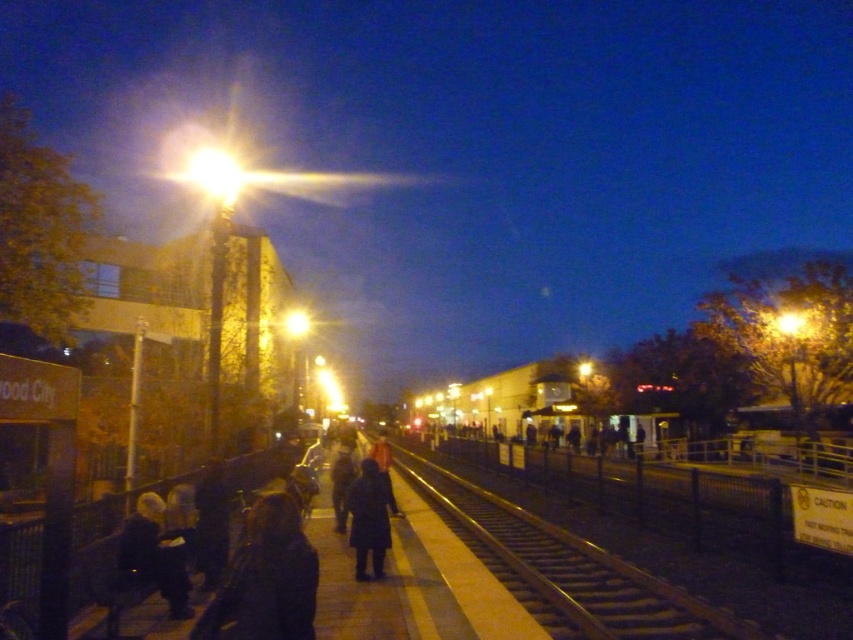
Question: Is dark blue coat at lower left wider than dark matte coat at center?

Choices:
 (A) no
 (B) yes

Answer: (A)

Question: Among these points, which one is nearest to the camera?

Choices:
 (A) (230, 625)
 (B) (610, 557)

Answer: (A)

Question: Can you confirm if metallic smooth train track at center is thinner than dark blue coat at lower left?

Choices:
 (A) no
 (B) yes

Answer: (A)

Question: Is metallic smooth train track at center closer to the viewer compared to dark matte coat at center?

Choices:
 (A) no
 (B) yes

Answer: (B)

Question: Which of these objects is positioned farthest from the dark matte coat at center?

Choices:
 (A) metallic smooth train track at center
 (B) dark fabric coat at lower left
 (C) dark blue coat at lower left

Answer: (B)

Question: Among these points, which one is nearest to the camera?

Choices:
 (A) (283, 600)
 (B) (358, 499)
 (C) (177, 566)

Answer: (A)